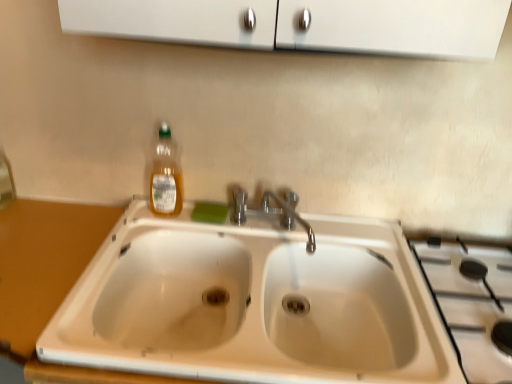
Where is `free space to the left of translucent plastic bottle at upper left`? This screenshot has width=512, height=384. free space to the left of translucent plastic bottle at upper left is located at coordinates (137, 213).